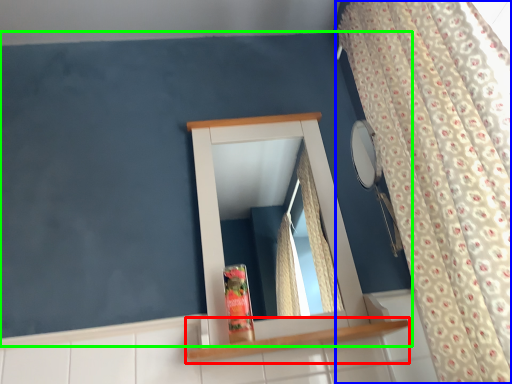
Question: Estimate the real-world distances between objects in this image. Which object is farther from shelf (highlighted by a red box), curtain (highlighted by a blue box) or backdrop (highlighted by a green box)?

Choices:
 (A) curtain
 (B) backdrop

Answer: (B)